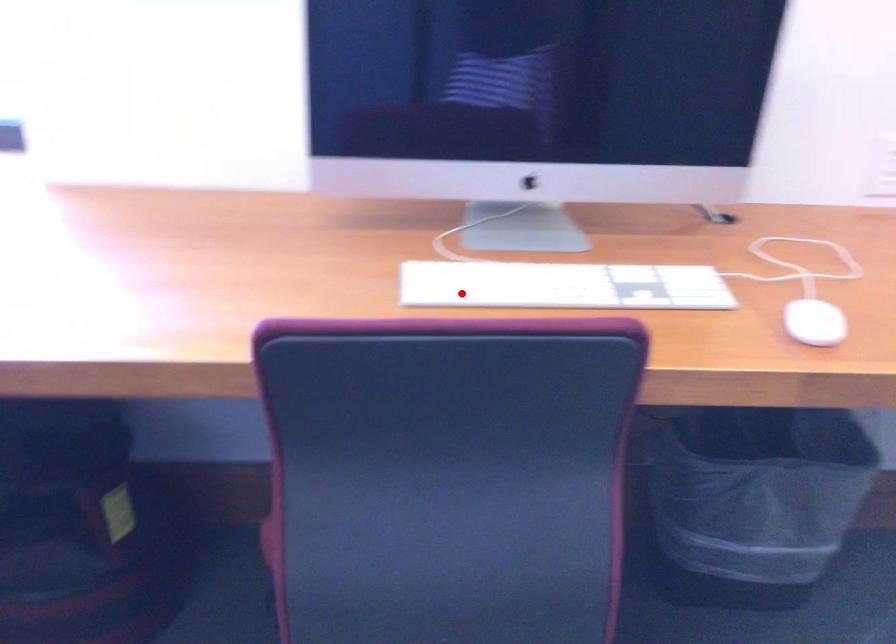
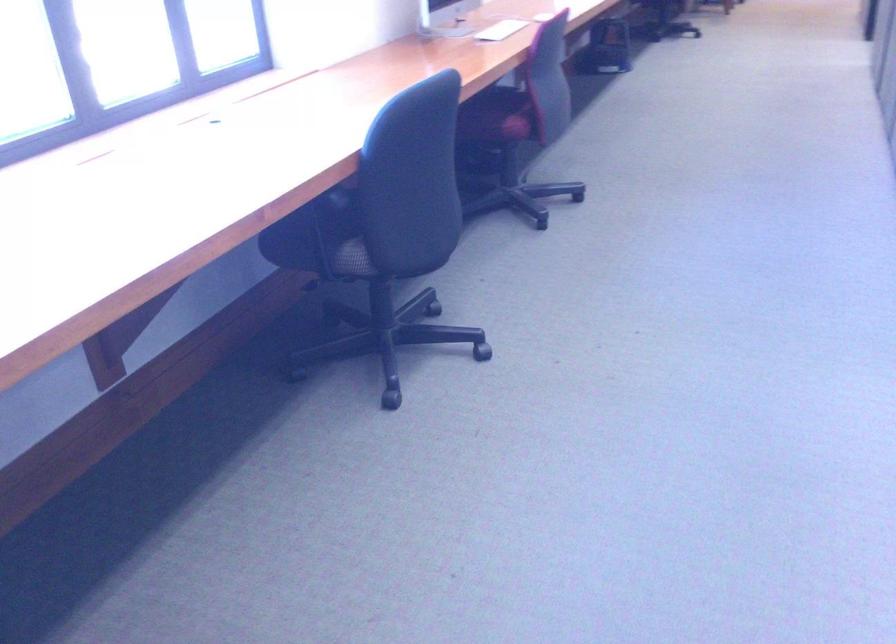
In the second image, find the point that corresponds to the highlighted location in the first image.

(501, 30)